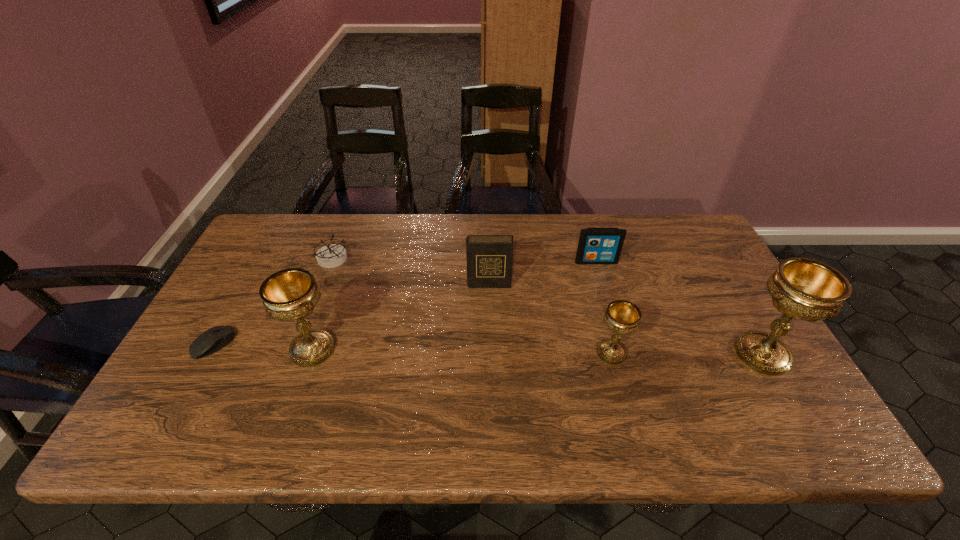
Identify the location of object located at the left edge. (215, 338).

At what (x,y) coordinates should I click in order to perform the action: click on object situated at the right edge. Please return your answer as a coordinate pair (x, y). This screenshot has height=540, width=960. Looking at the image, I should click on (806, 289).

At what (x,y) coordinates should I click in order to perform the action: click on object that is at the near right corner. Please return your answer as a coordinate pair (x, y). Looking at the image, I should click on (806, 289).

This screenshot has width=960, height=540. Find the location of `blank space at the far edge`. blank space at the far edge is located at coordinates (372, 215).

What are the coordinates of `vacant space at the near edge of the desktop` in the screenshot? It's located at (248, 379).

The height and width of the screenshot is (540, 960). In the image, there is a desktop. Identify the location of vacant space at the right edge. (677, 284).

Where is `free point between the fourth object from left to right and the leftmost chalice`? Image resolution: width=960 pixels, height=540 pixels. free point between the fourth object from left to right and the leftmost chalice is located at coordinates (400, 316).

What are the coordinates of `empty space between the second tallest object and the rightmost chalice` in the screenshot? It's located at 538,352.

Identify the location of free point between the rightmost object and the leftmost chalice. [x=538, y=352].

Where is `vacant area that lies between the second shortest object and the rightmost chalice`? The image size is (960, 540). vacant area that lies between the second shortest object and the rightmost chalice is located at coordinates (547, 307).